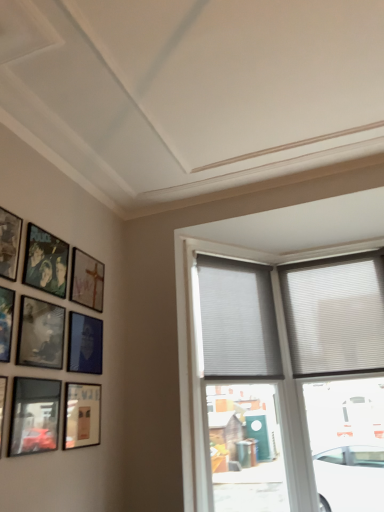
What is the approximate width of matte black picture frame at upper left, acting as the seventh picture frame starting from the back?

The width of matte black picture frame at upper left, acting as the seventh picture frame starting from the back, is 1.22 inches.

This screenshot has width=384, height=512. Describe the element at coordinates (9, 243) in the screenshot. I see `matte black picture frame at upper left, the 3th picture frame positioned from the front` at that location.

What do you see at coordinates (237, 320) in the screenshot? This screenshot has width=384, height=512. I see `white pleated blinds at upper center, the 1th window positioned from the left` at bounding box center [237, 320].

Describe the element at coordinates (87, 280) in the screenshot. This screenshot has width=384, height=512. I see `wooden frame at upper left, the 9th picture frame in the front-to-back sequence` at that location.

What do you see at coordinates (40, 334) in the screenshot?
I see `matte black picture frame at upper left, the 5th picture frame from the front` at bounding box center [40, 334].

Describe the element at coordinates (82, 415) in the screenshot. The height and width of the screenshot is (512, 384). I see `matte gold picture frame at lower left, the seventh picture frame when ordered from front to back` at that location.

What is the approximate height of metallic silver picture frame at left, marked as the second picture frame in a front-to-back arrangement?

The height of metallic silver picture frame at left, marked as the second picture frame in a front-to-back arrangement, is 13.26 inches.

I want to click on matte black picture frame at upper left, acting as the seventh picture frame starting from the back, so click(9, 243).

Would you say matte blue picture frame at lower left, which ranks as the 2th picture frame in back-to-front order, is part of white pleated blinds at upper center, the 1th window positioned from the left,'s contents?

No, matte blue picture frame at lower left, which ranks as the 2th picture frame in back-to-front order, is not surrounded by white pleated blinds at upper center, the 1th window positioned from the left.

Is white pleated blinds at upper center, the 3th window in the right-to-left sequence, at the left side of matte blue picture frame at lower left, placed as the eighth picture frame when sorted from front to back?

No, white pleated blinds at upper center, the 3th window in the right-to-left sequence, is not to the left of matte blue picture frame at lower left, placed as the eighth picture frame when sorted from front to back.

From the image's perspective, is white pleated blinds at upper center, the 1th window positioned from the left, positioned above or below matte blue picture frame at lower left, which ranks as the 2th picture frame in back-to-front order?

Based on their image positions, white pleated blinds at upper center, the 1th window positioned from the left, is located above matte blue picture frame at lower left, which ranks as the 2th picture frame in back-to-front order.

Can you tell me how much matte black picture frame at upper left, positioned as the 6th picture frame in front-to-back order, and white pleated blinds at upper center, the 1th window positioned from the left, differ in facing direction?

The angle between the facing direction of matte black picture frame at upper left, positioned as the 6th picture frame in front-to-back order, and the facing direction of white pleated blinds at upper center, the 1th window positioned from the left, is 39.4 degrees.

From the picture: From a real-world perspective, who is located higher, matte black picture frame at upper left, which is the 4th picture frame from back to front, or white pleated blinds at upper center, the 1th window positioned from the left?

matte black picture frame at upper left, which is the 4th picture frame from back to front.

Is point (52, 273) less distant than point (201, 330)?

Yes, it is in front of point (201, 330).

Measure the distance from matte black picture frame at upper left, which is the 4th picture frame from back to front, to white pleated blinds at upper center, the 3th window in the right-to-left sequence.

4.76 feet.

From the picture: From a real-world perspective, is matte black picture frame at upper left, the 3th picture frame positioned from the front, beneath matte black picture frame at lower left, which ranks as the 9th picture frame in back-to-front order?

No, from a real-world perspective, matte black picture frame at upper left, the 3th picture frame positioned from the front, is not under matte black picture frame at lower left, which ranks as the 9th picture frame in back-to-front order.

Which is more to the right, matte black picture frame at upper left, acting as the seventh picture frame starting from the back, or matte black picture frame at lower left, which ranks as the 9th picture frame in back-to-front order?

From the viewer's perspective, matte black picture frame at lower left, which ranks as the 9th picture frame in back-to-front order, appears more on the right side.

Is matte black picture frame at upper left, the 3th picture frame positioned from the front, wider than matte black picture frame at lower left, which ranks as the 9th picture frame in back-to-front order?

Yes.

Looking at this image, is matte black picture frame at upper left, acting as the seventh picture frame starting from the back, oriented towards matte black picture frame at lower left, the 1th picture frame from the front?

No, matte black picture frame at upper left, acting as the seventh picture frame starting from the back, is not aimed at matte black picture frame at lower left, the 1th picture frame from the front.

Which object is closer to the camera taking this photo, metallic reflective frame at lower left, which is the 6th picture frame in back-to-front order, or white textured blinds at upper right, the third window when ordered from left to right?

Positioned in front is metallic reflective frame at lower left, which is the 6th picture frame in back-to-front order.

Considering the sizes of objects metallic reflective frame at lower left, which is the 6th picture frame in back-to-front order, and white textured blinds at upper right, the third window when ordered from left to right, in the image provided, who is smaller, metallic reflective frame at lower left, which is the 6th picture frame in back-to-front order, or white textured blinds at upper right, the third window when ordered from left to right,?

metallic reflective frame at lower left, which is the 6th picture frame in back-to-front order.

From a real-world perspective, which is physically below, metallic reflective frame at lower left, which is the 6th picture frame in back-to-front order, or white textured blinds at upper right, the 1th window from the right?

metallic reflective frame at lower left, which is the 6th picture frame in back-to-front order.

Considering the positions of objects metallic reflective frame at lower left, placed as the 4th picture frame when sorted from front to back, and white textured blinds at upper right, the third window when ordered from left to right, in the image provided, who is more to the left, metallic reflective frame at lower left, placed as the 4th picture frame when sorted from front to back, or white textured blinds at upper right, the third window when ordered from left to right,?

metallic reflective frame at lower left, placed as the 4th picture frame when sorted from front to back, is more to the left.

Is matte gold picture frame at lower left, the seventh picture frame when ordered from front to back, positioned far away from matte black picture frame at upper left, the 5th picture frame from the front?

A: Actually, matte gold picture frame at lower left, the seventh picture frame when ordered from front to back, and matte black picture frame at upper left, the 5th picture frame from the front, are a little close together.

Considering the positions of point (91, 388) and point (45, 318), is point (91, 388) closer or farther from the camera than point (45, 318)?

Point (91, 388) is positioned farther from the camera compared to point (45, 318).

Considering the relative sizes of matte gold picture frame at lower left, the seventh picture frame when ordered from front to back, and matte black picture frame at upper left, the 5th picture frame viewed from the back, in the image provided, is matte gold picture frame at lower left, the seventh picture frame when ordered from front to back, wider than matte black picture frame at upper left, the 5th picture frame viewed from the back,?

No.

Is matte black picture frame at upper left, positioned as the 6th picture frame in front-to-back order, positioned with its back to metallic reflective frame at lower left, which is the 6th picture frame in back-to-front order?

matte black picture frame at upper left, positioned as the 6th picture frame in front-to-back order, does not have its back to metallic reflective frame at lower left, which is the 6th picture frame in back-to-front order.

Who is bigger, matte black picture frame at upper left, positioned as the 6th picture frame in front-to-back order, or metallic reflective frame at lower left, which is the 6th picture frame in back-to-front order?

Bigger between the two is metallic reflective frame at lower left, which is the 6th picture frame in back-to-front order.

You are a GUI agent. You are given a task and a screenshot of the screen. Output one action in this format:
    pyautogui.click(x=<x>, y=<y>)
    Task: Click on the 2nd picture frame to the right when counting from the matte black picture frame at upper left, positioned as the 6th picture frame in front-to-back order
    This screenshot has width=384, height=512.
    Given the screenshot: What is the action you would take?
    pyautogui.click(x=34, y=416)

How distant is matte black picture frame at upper left, which is the 4th picture frame from back to front, from metallic reflective frame at lower left, placed as the 4th picture frame when sorted from front to back?

23.78 inches.

From the picture: Could you tell me if matte black picture frame at upper left, which is the 4th picture frame from back to front, is turned towards matte blue picture frame at lower left, placed as the eighth picture frame when sorted from front to back?

No, matte black picture frame at upper left, which is the 4th picture frame from back to front, is not turned towards matte blue picture frame at lower left, placed as the eighth picture frame when sorted from front to back.

How many degrees apart are the facing directions of matte black picture frame at upper left, positioned as the 6th picture frame in front-to-back order, and matte blue picture frame at lower left, placed as the eighth picture frame when sorted from front to back?

0.00639 degrees separate the facing orientations of matte black picture frame at upper left, positioned as the 6th picture frame in front-to-back order, and matte blue picture frame at lower left, placed as the eighth picture frame when sorted from front to back.

Which object is closer to the camera taking this photo, matte black picture frame at upper left, which is the 4th picture frame from back to front, or matte blue picture frame at lower left, placed as the eighth picture frame when sorted from front to back?

matte black picture frame at upper left, which is the 4th picture frame from back to front, is closer to the camera.

How distant is matte black picture frame at upper left, positioned as the 6th picture frame in front-to-back order, from matte blue picture frame at lower left, which ranks as the 2th picture frame in back-to-front order?

matte black picture frame at upper left, positioned as the 6th picture frame in front-to-back order, and matte blue picture frame at lower left, which ranks as the 2th picture frame in back-to-front order, are 13.38 inches apart from each other.

Where is `the 2nd window positioned above the matte blue picture frame at lower left, placed as the eighth picture frame when sorted from front to back (from a real-world perspective)`? the 2nd window positioned above the matte blue picture frame at lower left, placed as the eighth picture frame when sorted from front to back (from a real-world perspective) is located at coordinates (237, 320).

The image size is (384, 512). Identify the location of the 4th picture frame in front when counting from the white pleated blinds at upper center, the 3th window in the right-to-left sequence. (45, 261).

Considering their positions, is matte black picture frame at upper left, the 3th picture frame positioned from the front, positioned further to matte black picture frame at upper left, which is the 4th picture frame from back to front, than white pleated blinds at upper center, the 3th window in the right-to-left sequence?

white pleated blinds at upper center, the 3th window in the right-to-left sequence, lies further to matte black picture frame at upper left, which is the 4th picture frame from back to front, than the other object.

Considering their positions, is metallic reflective frame at lower left, placed as the 4th picture frame when sorted from front to back, positioned further to matte black picture frame at lower left, which ranks as the 9th picture frame in back-to-front order, than white textured blinds at upper right, the third window when ordered from left to right?

white textured blinds at upper right, the third window when ordered from left to right, is further to matte black picture frame at lower left, which ranks as the 9th picture frame in back-to-front order.

Looking at the image, which one is located further to wooden frame at upper left, marked as the 1th picture frame in a back-to-front arrangement, metallic reflective frame at lower left, which is the 6th picture frame in back-to-front order, or white textured blinds at upper right, which appears as the second window when viewed from the left?

Based on the image, white textured blinds at upper right, which appears as the second window when viewed from the left, appears to be further to wooden frame at upper left, marked as the 1th picture frame in a back-to-front arrangement.

Looking at the image, which one is located closer to matte black picture frame at lower left, which ranks as the 9th picture frame in back-to-front order, metallic reflective frame at lower left, placed as the 4th picture frame when sorted from front to back, or matte blue picture frame at lower left, which ranks as the 2th picture frame in back-to-front order?

metallic reflective frame at lower left, placed as the 4th picture frame when sorted from front to back, lies closer to matte black picture frame at lower left, which ranks as the 9th picture frame in back-to-front order, than the other object.

Based on their spatial positions, is matte black picture frame at upper left, the 5th picture frame from the front, or metallic reflective frame at lower left, which is the 6th picture frame in back-to-front order, further from matte black picture frame at upper left, positioned as the 6th picture frame in front-to-back order?

metallic reflective frame at lower left, which is the 6th picture frame in back-to-front order, lies further to matte black picture frame at upper left, positioned as the 6th picture frame in front-to-back order, than the other object.

Estimate the real-world distances between objects in this image. Which object is further from metallic silver picture frame at left, which is counted as the eighth picture frame, starting from the back, white pleated blinds at upper center, the 3th window in the right-to-left sequence, or matte black picture frame at upper left, which is the 4th picture frame from back to front?

white pleated blinds at upper center, the 3th window in the right-to-left sequence.

Estimate the real-world distances between objects in this image. Which object is closer to matte blue picture frame at lower left, which ranks as the 2th picture frame in back-to-front order, wooden frame at upper left, marked as the 1th picture frame in a back-to-front arrangement, or metallic silver picture frame at left, which is counted as the eighth picture frame, starting from the back?

Among the two, wooden frame at upper left, marked as the 1th picture frame in a back-to-front arrangement, is located nearer to matte blue picture frame at lower left, which ranks as the 2th picture frame in back-to-front order.

Which object lies further to the anchor point matte black picture frame at upper left, the 5th picture frame from the front, metallic reflective frame at lower left, placed as the 4th picture frame when sorted from front to back, or white textured blinds at upper right, which appears as the 2th window when viewed from the right?

Based on the image, white textured blinds at upper right, which appears as the 2th window when viewed from the right, appears to be further to matte black picture frame at upper left, the 5th picture frame from the front.

The image size is (384, 512). I want to click on window situated between wooden frame at upper left, the 9th picture frame in the front-to-back sequence, and white textured blinds at upper right, which appears as the second window when viewed from the left, from left to right, so click(x=237, y=320).

The height and width of the screenshot is (512, 384). Identify the location of window between matte gold picture frame at lower left, the seventh picture frame when ordered from front to back, and white textured blinds at upper right, which appears as the second window when viewed from the left. (237, 320).

In order to click on window between matte black picture frame at upper left, the 3th picture frame positioned from the front, and white textured blinds at upper right, which appears as the second window when viewed from the left, from left to right in this screenshot , I will do `click(237, 320)`.

The width and height of the screenshot is (384, 512). I want to click on window between matte black picture frame at upper left, which is the 4th picture frame from back to front, and white textured blinds at upper right, which appears as the second window when viewed from the left, from left to right, so click(x=237, y=320).